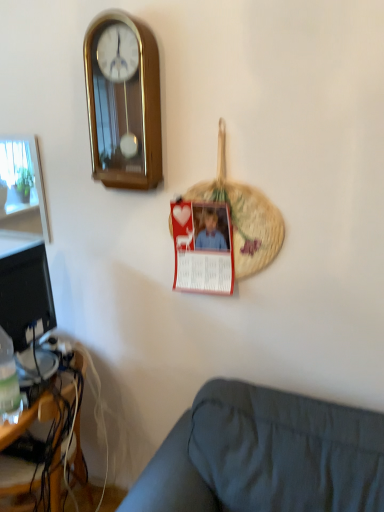
Question: Are dark gray fabric couch at lower right and gold polished wood wall clock at upper left far apart?

Choices:
 (A) no
 (B) yes

Answer: (A)

Question: Is dark gray fabric couch at lower right next to gold polished wood wall clock at upper left?

Choices:
 (A) no
 (B) yes

Answer: (A)

Question: Is dark gray fabric couch at lower right oriented towards gold polished wood wall clock at upper left?

Choices:
 (A) no
 (B) yes

Answer: (A)

Question: Can you confirm if dark gray fabric couch at lower right is taller than gold polished wood wall clock at upper left?

Choices:
 (A) no
 (B) yes

Answer: (B)

Question: Is dark gray fabric couch at lower right turned away from gold polished wood wall clock at upper left?

Choices:
 (A) no
 (B) yes

Answer: (A)

Question: Relative to translucent plastic bottle at lower left, is dark gray fabric couch at lower right in front or behind?

Choices:
 (A) front
 (B) behind

Answer: (A)

Question: Choose the correct answer: Is dark gray fabric couch at lower right inside translucent plastic bottle at lower left or outside it?

Choices:
 (A) inside
 (B) outside

Answer: (B)

Question: Looking at the image, does dark gray fabric couch at lower right seem bigger or smaller compared to translucent plastic bottle at lower left?

Choices:
 (A) small
 (B) big

Answer: (B)

Question: Considering the positions of dark gray fabric couch at lower right and translucent plastic bottle at lower left in the image, is dark gray fabric couch at lower right wider or thinner than translucent plastic bottle at lower left?

Choices:
 (A) thin
 (B) wide

Answer: (B)

Question: Considering the positions of gold polished wood wall clock at upper left and red paper postcard at center in the image, is gold polished wood wall clock at upper left wider or thinner than red paper postcard at center?

Choices:
 (A) thin
 (B) wide

Answer: (B)

Question: Is gold polished wood wall clock at upper left situated inside red paper postcard at center or outside?

Choices:
 (A) outside
 (B) inside

Answer: (A)

Question: Is point (148, 56) positioned closer to the camera than point (196, 205)?

Choices:
 (A) closer
 (B) farther

Answer: (A)

Question: Is gold polished wood wall clock at upper left to the left or to the right of red paper postcard at center in the image?

Choices:
 (A) left
 (B) right

Answer: (A)

Question: From a real-world perspective, relative to red paper postcard at center, is wooden desk at lower left vertically above or below?

Choices:
 (A) below
 (B) above

Answer: (A)

Question: Considering the positions of point (16, 476) and point (183, 260), is point (16, 476) closer or farther from the camera than point (183, 260)?

Choices:
 (A) closer
 (B) farther

Answer: (B)